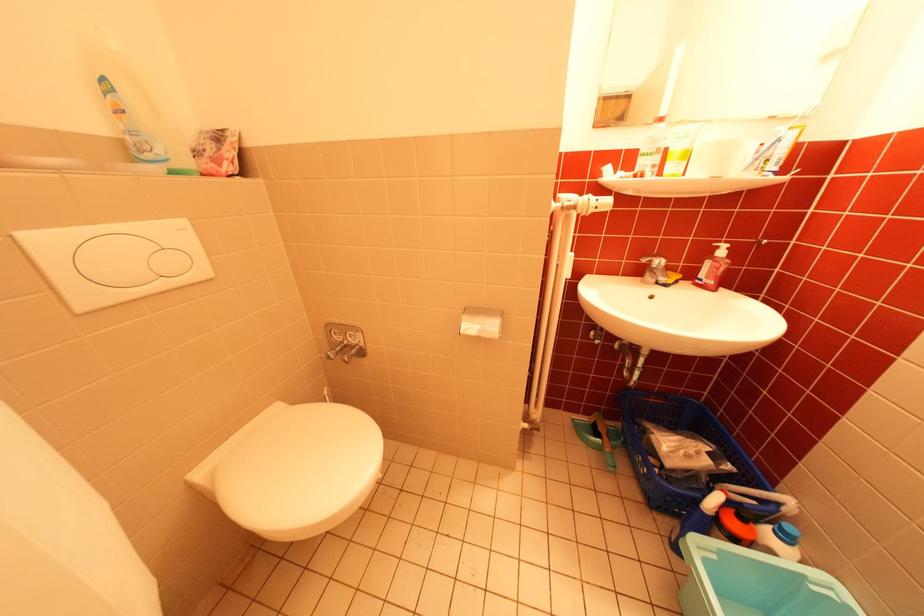
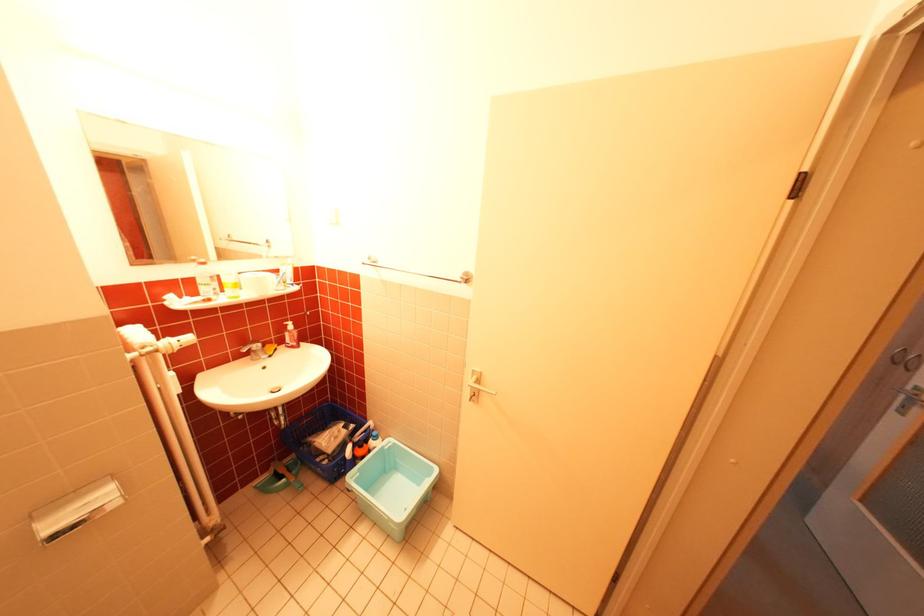
In the second image, find the point that corresponds to [658,276] in the first image.

(263, 355)